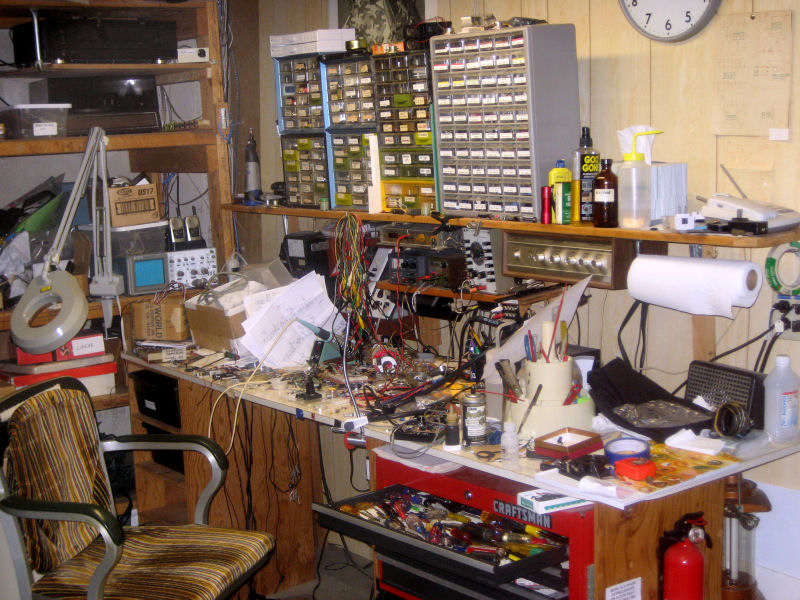
Locate an element on the screen. The height and width of the screenshot is (600, 800). cardboard box is located at coordinates [133, 191], [162, 328], [216, 329].